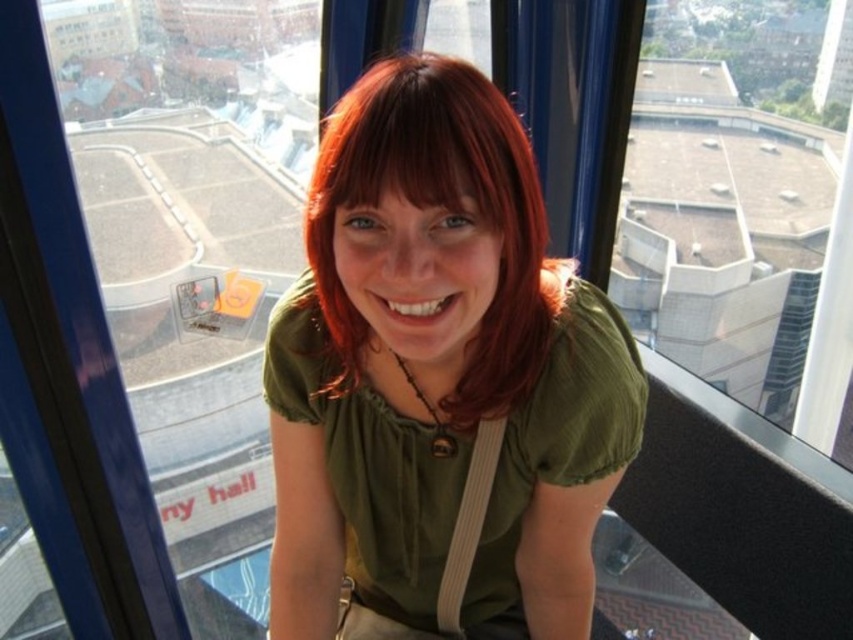
Can you confirm if matte green shirt at center is smaller than shiny red hair at center?

No, matte green shirt at center is not smaller than shiny red hair at center.

Is matte green shirt at center bigger than shiny red hair at center?

Yes, matte green shirt at center is bigger than shiny red hair at center.

What do you see at coordinates (439, 380) in the screenshot?
I see `matte green shirt at center` at bounding box center [439, 380].

Locate an element on the screen. The image size is (853, 640). matte green shirt at center is located at coordinates (439, 380).